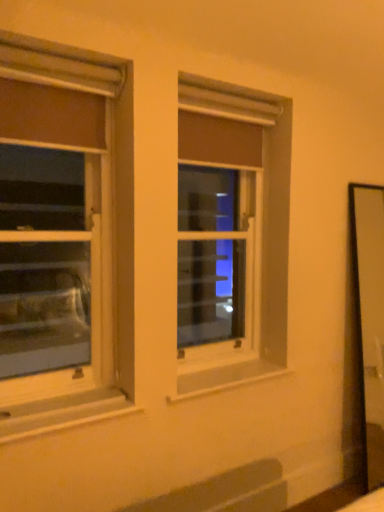
The image size is (384, 512). In order to click on empty space that is ontop of white painted wood at lower left (from a real-world perspective) in this screenshot , I will do `click(64, 396)`.